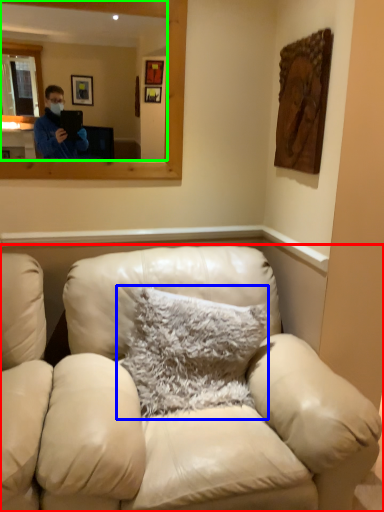
Question: Which object is positioned farthest from studio couch (highlighted by a red box)? Select from pillow (highlighted by a blue box) and mirror (highlighted by a green box).

Choices:
 (A) pillow
 (B) mirror

Answer: (B)